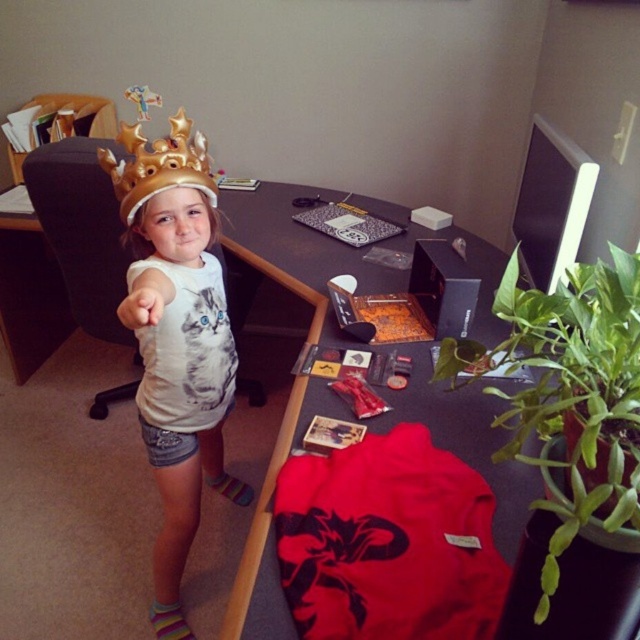
You are a photographer trying to capture a closeup shot of the matte gold crown at center. The camera you are using has a minimum focusing distance of 25 inches. Based on the scene description, can you successfully take the photo without moving the crown?

The matte gold crown at center is 30.39 inches away from the camera, which is greater than the minimum focusing distance of 25 inches. Therefore, you can successfully take the photo without moving the crown.

The scene shows a young girl in an office setting with two crowns. Which crown is positioned lower on her head, the matte gold crown at center or the gold metallic crown at upper center?

The matte gold crown at center is positioned lower on her head as it is located below the gold metallic crown at upper center.

Where is the matte gold crown at center located in the image?

The matte gold crown at center is located at point [180,374] in the image.